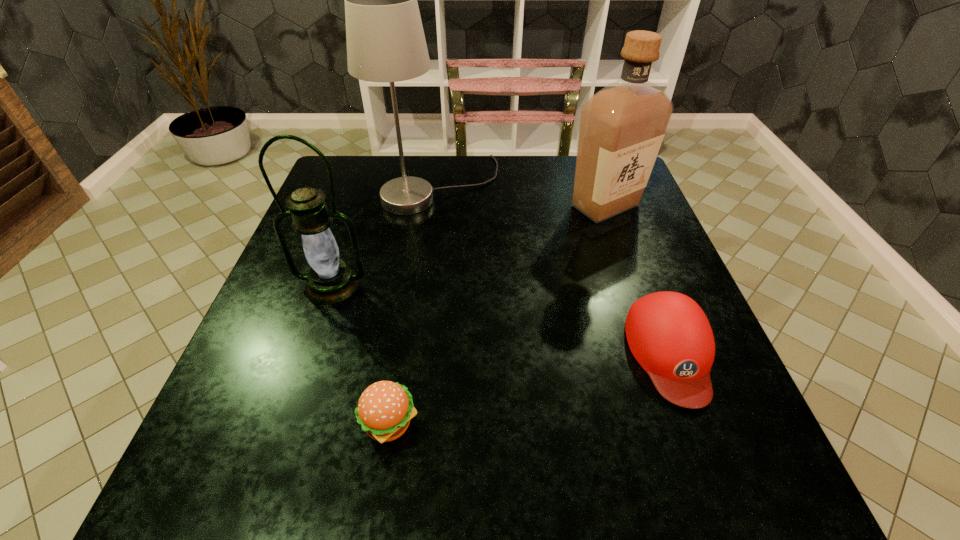
The width and height of the screenshot is (960, 540). Identify the location of vacant space at the far edge. (517, 188).

Find the location of a particular element. The height and width of the screenshot is (540, 960). vacant space at the near edge of the desktop is located at coordinates (523, 462).

At what (x,y) coordinates should I click in order to perform the action: click on blank area at the left edge. Please return your answer as a coordinate pair (x, y). The image size is (960, 540). Looking at the image, I should click on (284, 284).

You are a GUI agent. You are given a task and a screenshot of the screen. Output one action in this format:
    pyautogui.click(x=<x>, y=<y>)
    Task: Click on the vacant space at the right edge of the desktop
    Image resolution: width=960 pixels, height=540 pixels.
    Given the screenshot: What is the action you would take?
    pyautogui.click(x=612, y=228)

Image resolution: width=960 pixels, height=540 pixels. In the image, there is a desktop. Identify the location of vacant space at the far left corner. (359, 176).

Where is `vacant space at the near left corner`? This screenshot has height=540, width=960. vacant space at the near left corner is located at coordinates (188, 492).

Image resolution: width=960 pixels, height=540 pixels. I want to click on free space between the hamburger and the table lamp, so click(414, 305).

Find the location of a particular element. free space between the hamburger and the liquor is located at coordinates (497, 315).

This screenshot has height=540, width=960. Identify the location of vacant region between the table lamp and the baseball cap. (555, 269).

Find the location of a particular element. The height and width of the screenshot is (540, 960). vacant space in between the third shortest object and the hamburger is located at coordinates (361, 355).